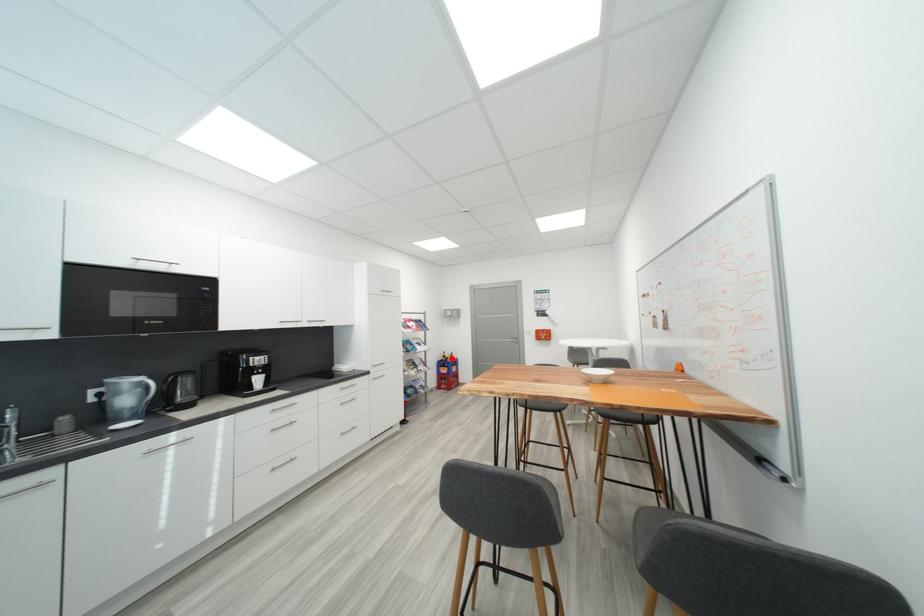
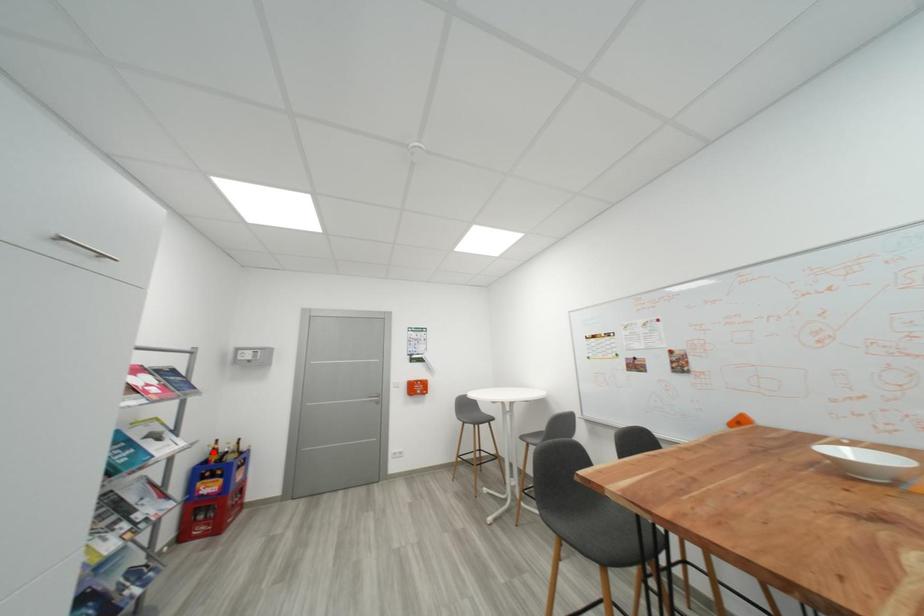
I am providing you with two images of the same scene from different viewpoints. A red point is marked on the first image and another point is marked on the second image. Do the highlighted points in image1 and image2 indicate the same real-world spot?

No